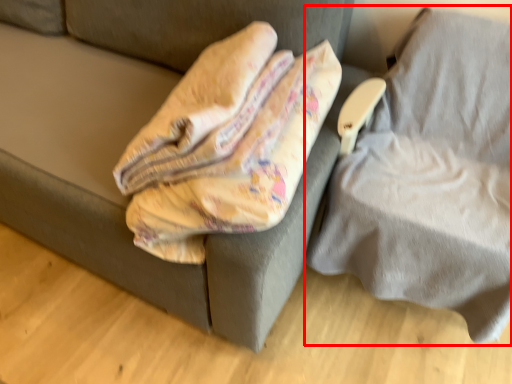
Question: From the image's perspective, what is the correct spatial relationship of furniture (annotated by the red box) in relation to furniture?

Choices:
 (A) above
 (B) below

Answer: (B)